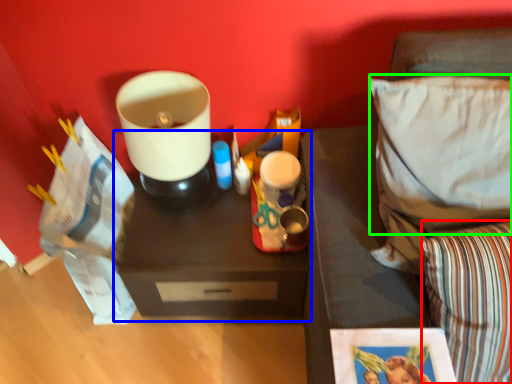
Question: Which object is the closest to the pillow (highlighted by a red box)? Choose among these: table (highlighted by a blue box) or pillow (highlighted by a green box).

Choices:
 (A) table
 (B) pillow

Answer: (B)